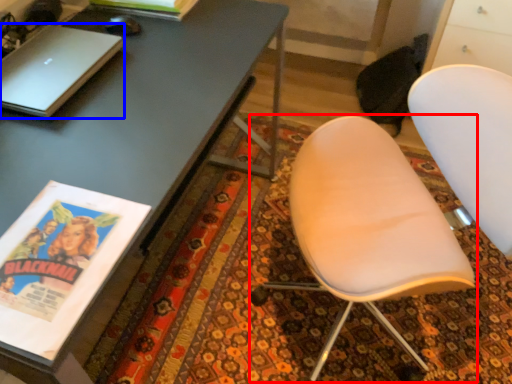
Question: Which object is closer to the camera taking this photo, chair (highlighted by a red box) or laptop (highlighted by a blue box)?

Choices:
 (A) chair
 (B) laptop

Answer: (A)